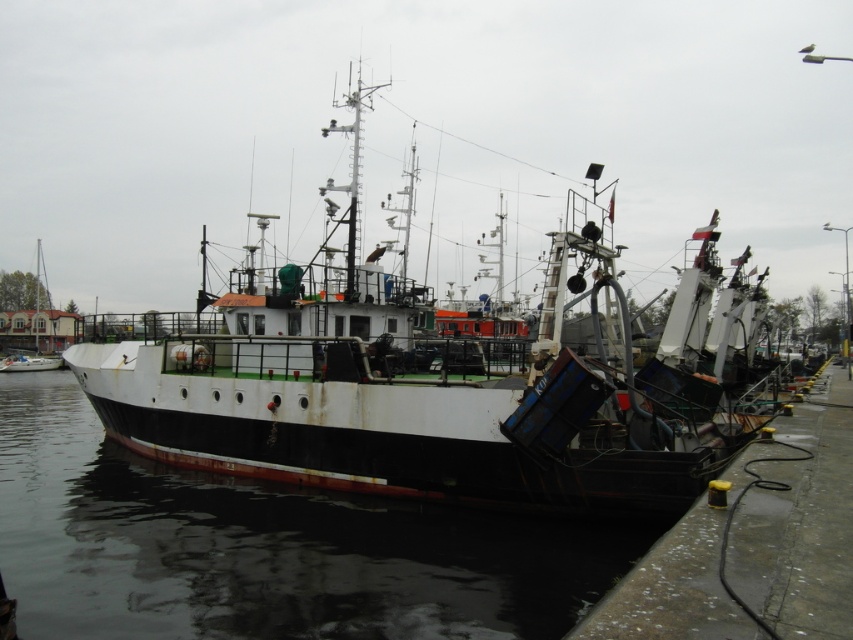
You are a dock worker who needs to determine if there is enough space to park another small boat between the rusty metal boat at center and the white matte boat at left. Based on their sizes, can you fit the new boat there?

The rusty metal boat at center occupies less space than the white matte boat at left. Therefore, there might be enough space between them to park the new small boat, but it depends on the exact dimensions and positioning of both boats.

You are a harbor inspector checking the position of the rusty metal boat at center. According to the coordinates provided, is the boat located closer to the northern or southern end of the dock?

The coordinates of the rusty metal boat at center are at point 0.605 on the x and 0.532 on the y axis. Since the dock is oriented along the y axis, the boat is closer to the southern end of the dock.

You are a marine biologist preparing to board the rusty metal boat at center for a research trip. You notice the black matte water at lower left near the dock. Considering the size difference between the two, which one would be more challenging to step onto from the dock?

The rusty metal boat at center is larger in size than the black matte water at lower left, so stepping onto the rusty metal boat at center would be more stable and less challenging compared to the black matte water at lower left.